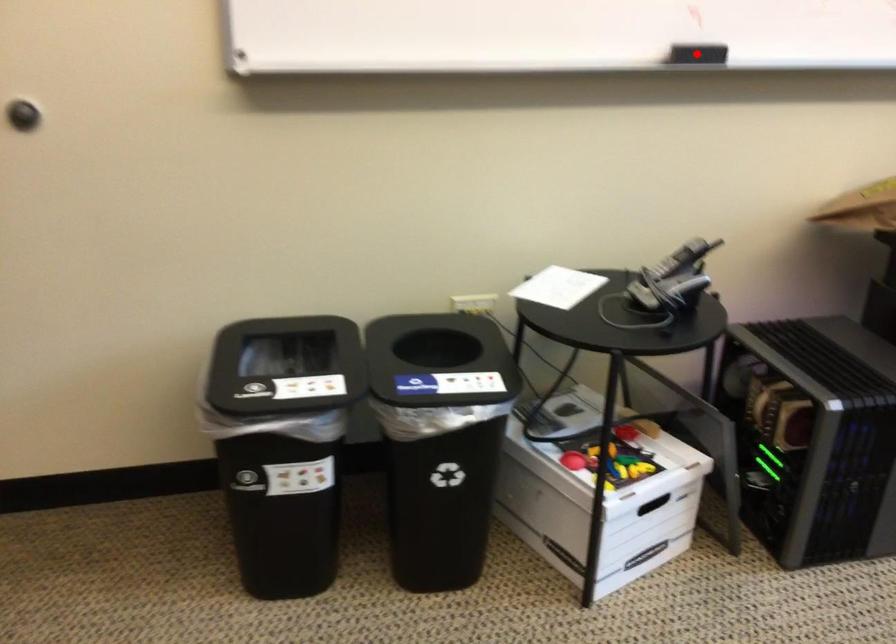
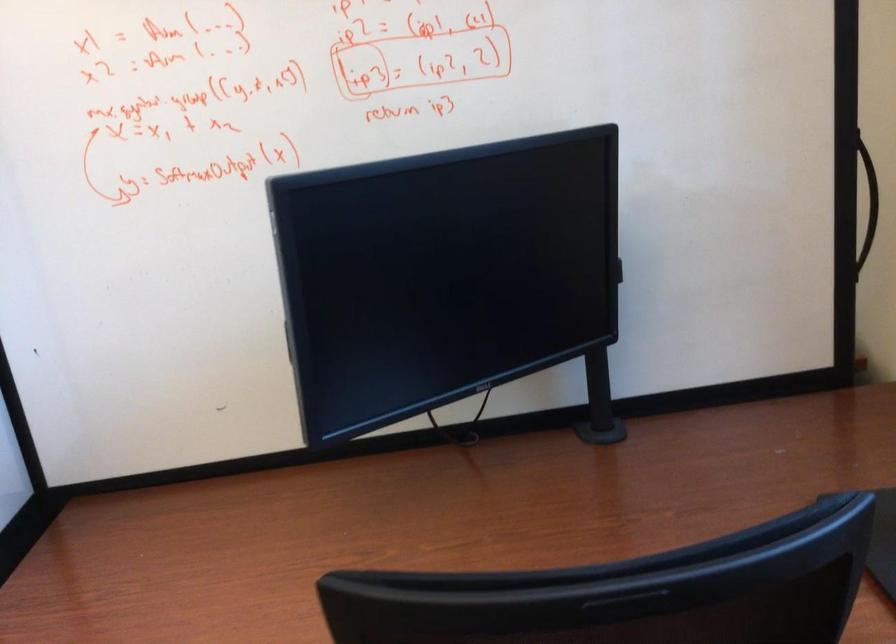
Question: I am providing you with two images of the same scene from different viewpoints. A red point is marked on the first image. At the location where the point appears in image 1, is it still visible in image 2?

Choices:
 (A) Yes
 (B) No

Answer: (B)